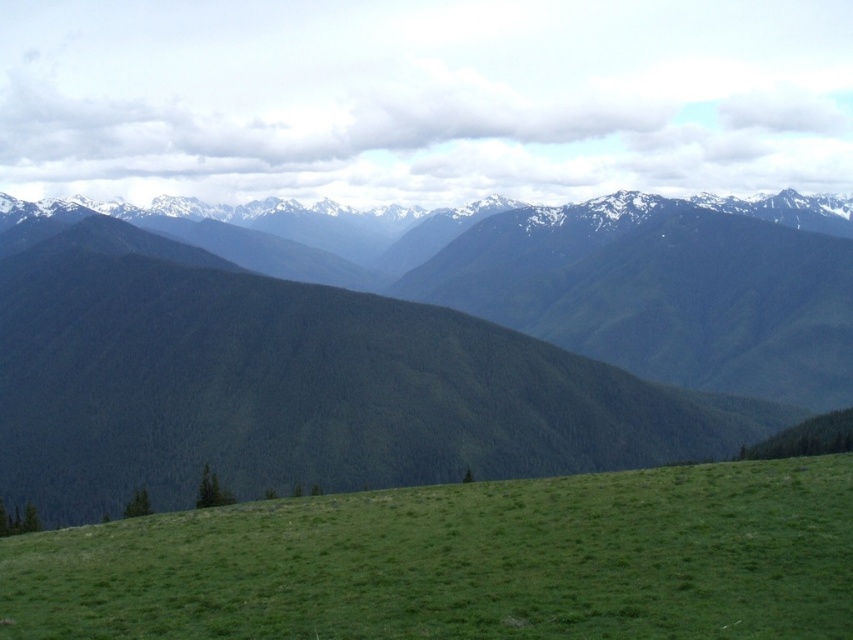
Does green forested mountain at center appear on the right side of green grassy hill at lower center?

Indeed, green forested mountain at center is positioned on the right side of green grassy hill at lower center.

Between green forested mountain at center and green grassy hill at lower center, which one has more height?

With more height is green forested mountain at center.

Is point (94, 220) positioned before point (54, 620)?

No, (94, 220) is behind (54, 620).

Where is `green forested mountain at center`? green forested mountain at center is located at coordinates (410, 355).